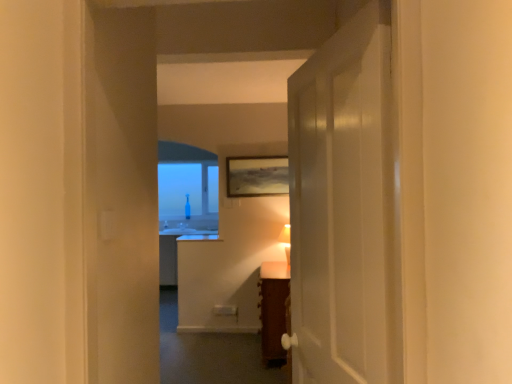
Question: Is wooden textured picture frame at center a part of white glossy door at center?

Choices:
 (A) yes
 (B) no

Answer: (B)

Question: Does white glossy door at center appear on the right side of wooden textured picture frame at center?

Choices:
 (A) yes
 (B) no

Answer: (A)

Question: Does white glossy door at center have a lesser height compared to wooden textured picture frame at center?

Choices:
 (A) no
 (B) yes

Answer: (A)

Question: Does white glossy door at center have a larger size compared to wooden textured picture frame at center?

Choices:
 (A) yes
 (B) no

Answer: (A)

Question: Is white glossy door at center positioned behind wooden textured picture frame at center?

Choices:
 (A) yes
 (B) no

Answer: (B)

Question: Is matte white table lamp at center in front of or behind white glossy door at center in the image?

Choices:
 (A) front
 (B) behind

Answer: (B)

Question: From their relative heights in the image, would you say matte white table lamp at center is taller or shorter than white glossy door at center?

Choices:
 (A) short
 (B) tall

Answer: (A)

Question: Considering the positions of matte white table lamp at center and white glossy door at center in the image, is matte white table lamp at center wider or thinner than white glossy door at center?

Choices:
 (A) wide
 (B) thin

Answer: (B)

Question: From a real-world perspective, is matte white table lamp at center physically located above or below white glossy door at center?

Choices:
 (A) above
 (B) below

Answer: (B)

Question: From a real-world perspective, relative to wooden cabinet at center, is wooden textured picture frame at center vertically above or below?

Choices:
 (A) below
 (B) above

Answer: (B)

Question: From the image's perspective, is wooden textured picture frame at center above or below wooden cabinet at center?

Choices:
 (A) below
 (B) above

Answer: (B)

Question: Choose the correct answer: Is wooden textured picture frame at center inside wooden cabinet at center or outside it?

Choices:
 (A) outside
 (B) inside

Answer: (A)

Question: Considering the positions of wooden textured picture frame at center and wooden cabinet at center in the image, is wooden textured picture frame at center bigger or smaller than wooden cabinet at center?

Choices:
 (A) small
 (B) big

Answer: (A)

Question: From a real-world perspective, is matte white table lamp at center physically located above or below wooden textured picture frame at center?

Choices:
 (A) above
 (B) below

Answer: (B)

Question: Is matte white table lamp at center bigger or smaller than wooden textured picture frame at center?

Choices:
 (A) big
 (B) small

Answer: (A)